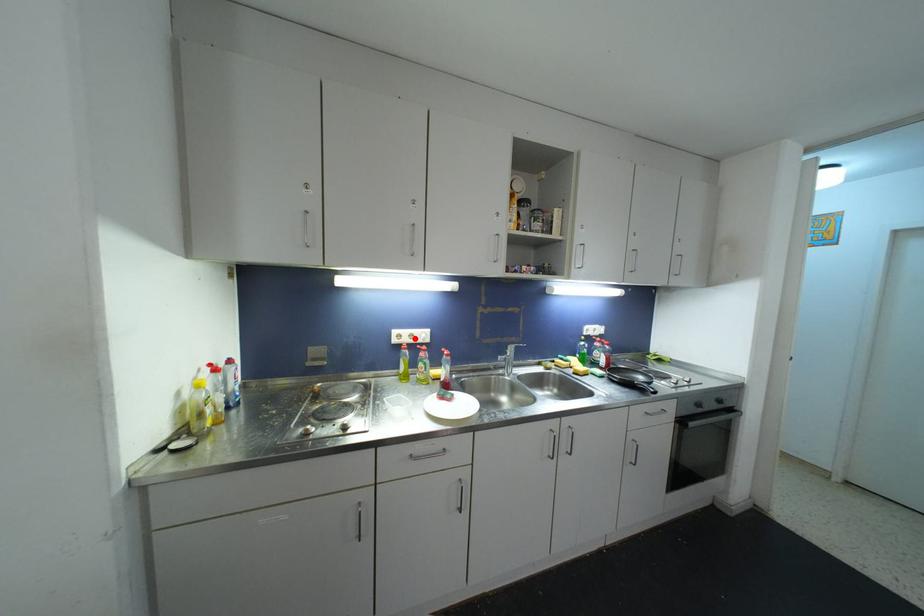
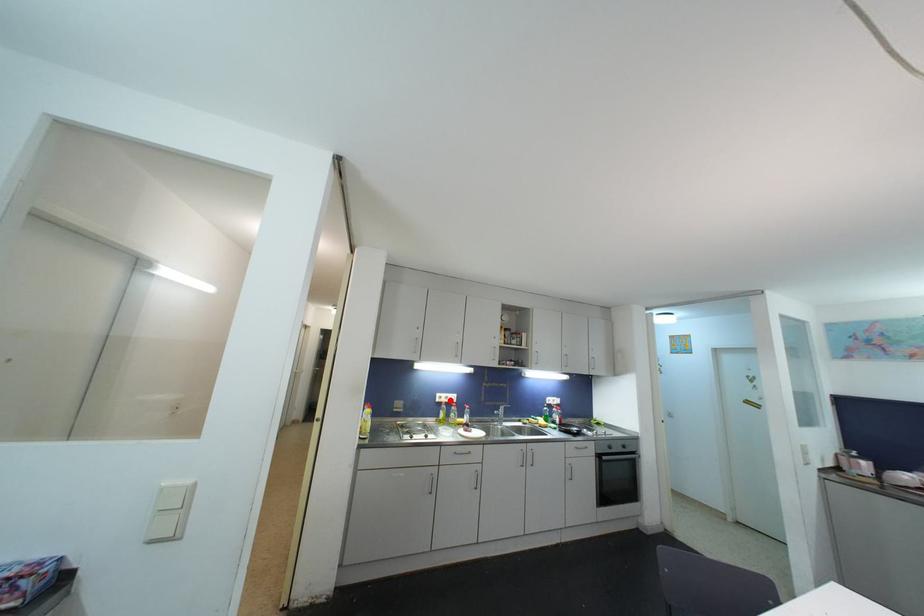
I am providing you with two images of the same scene from different viewpoints. A red point is marked on the first image and another point is marked on the second image. Does the point marked in image1 correspond to the same location as the one in image2?

Yes